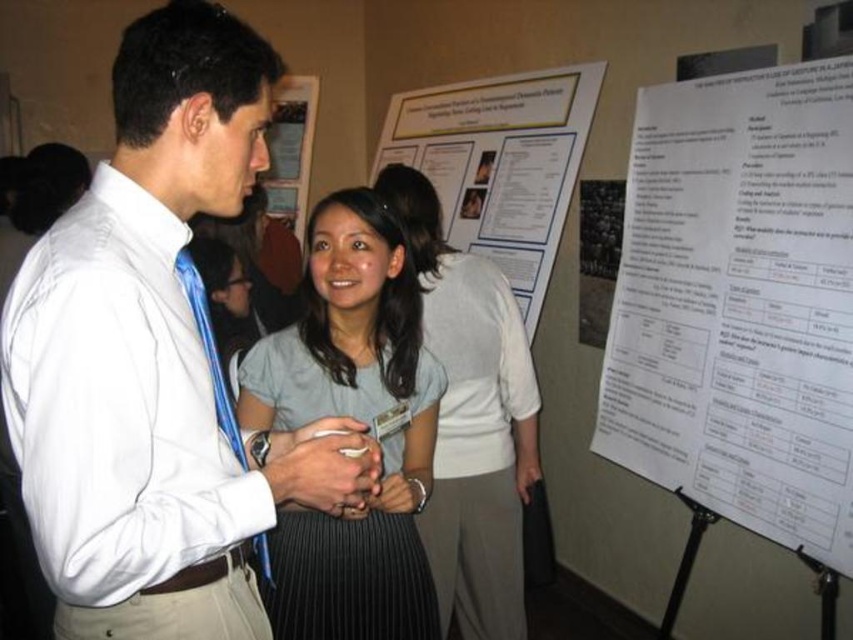
You are an event organizer who needs to hang both the white paper poster at center and the white paper at center on a wall. The wall has a height limit of 1.5 meters. Can both items be displayed without exceeding the height limit?

The white paper poster at center is much taller than the white paper at center. Since the wall has a height limit of 1.5 meters, you need to check the height of the taller item, which is the white paper poster at center. If its height is under 1.5 meters, both can be displayed. If not, only the shorter white paper at center can be hung.

You are standing in the conference room and want to grab the white paper at upper right to take notes. The distance you can reach is 5 feet. Can you reach it without moving closer?

The white paper at upper right is 5.20 feet away from viewer, so you cannot reach it as it is 0.20 feet beyond your 5 feet reach.

You are organizing a photo shoot and need to ensure that the white shirt at center and the white paper poster at center are both visible in the frame. Based on their sizes, which object should you prioritize positioning closer to the camera to ensure clarity?

The white shirt at center occupies less space than the white paper poster at center, so you should prioritize positioning the white shirt at center closer to the camera to ensure its details are clear.